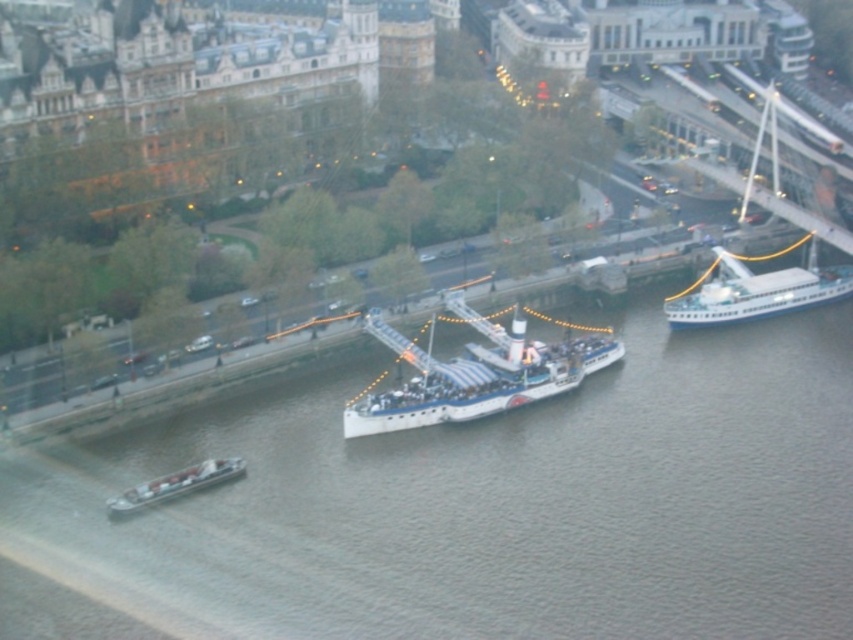
Question: Which of the following is the closest to the observer?

Choices:
 (A) white glossy ship at upper right
 (B) white plastic boat at lower left

Answer: (B)

Question: Which object appears closest to the camera in this image?

Choices:
 (A) white glossy boat at center
 (B) gray matte water at center
 (C) white glossy ship at upper right

Answer: (B)

Question: Is white glossy boat at center positioned in front of white glossy ship at upper right?

Choices:
 (A) yes
 (B) no

Answer: (A)

Question: Does gray matte water at center appear on the left side of white glossy ship at upper right?

Choices:
 (A) no
 (B) yes

Answer: (B)

Question: Which point is farther to the camera?

Choices:
 (A) (494, 397)
 (B) (155, 480)
 (C) (701, 307)

Answer: (C)

Question: Is white glossy boat at center bigger than white plastic boat at lower left?

Choices:
 (A) no
 (B) yes

Answer: (B)